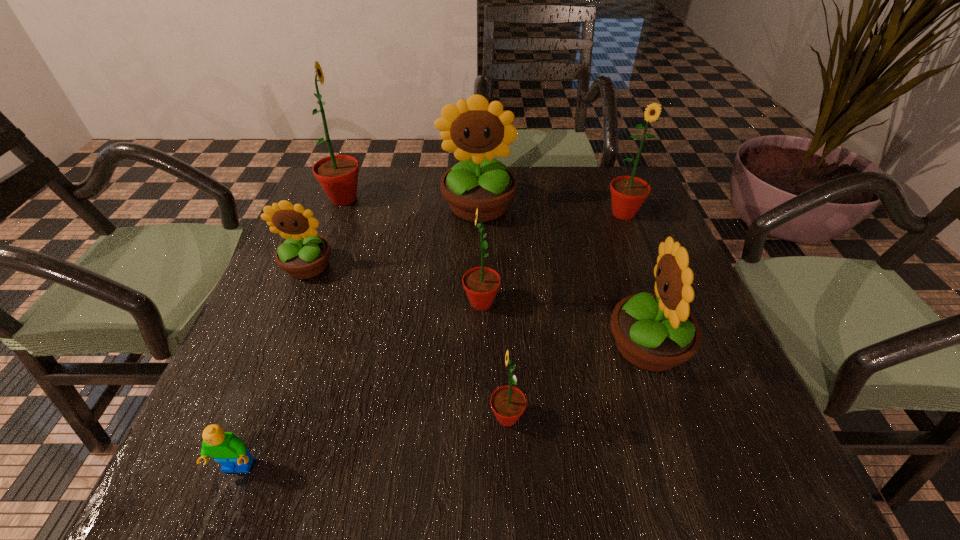
The width and height of the screenshot is (960, 540). Identify the location of object present at the far left corner. (338, 174).

Find the location of a particular element. The height and width of the screenshot is (540, 960). object at the near left corner is located at coordinates (226, 448).

The width and height of the screenshot is (960, 540). Find the location of `object that is at the far right corner`. object that is at the far right corner is located at coordinates (628, 193).

You are a GUI agent. You are given a task and a screenshot of the screen. Output one action in this format:
    pyautogui.click(x=<x>, y=<y>)
    Task: Click on the vacant space at the far edge
    The height and width of the screenshot is (540, 960).
    Given the screenshot: What is the action you would take?
    pyautogui.click(x=530, y=198)

The image size is (960, 540). In order to click on free space at the near edge of the desktop in this screenshot , I will do `click(444, 489)`.

The width and height of the screenshot is (960, 540). What are the coordinates of `free space at the left edge` in the screenshot? It's located at (259, 327).

I want to click on free space at the right edge of the desktop, so click(x=720, y=394).

You are a GUI agent. You are given a task and a screenshot of the screen. Output one action in this format:
    pyautogui.click(x=<x>, y=<y>)
    Task: Click on the vacant space at the near left corner of the desktop
    
    Given the screenshot: What is the action you would take?
    pyautogui.click(x=187, y=464)

This screenshot has height=540, width=960. In order to click on vacant area at the far right corner in this screenshot , I will do `click(601, 177)`.

At what (x,y) coordinates should I click in order to perform the action: click on empty space that is in between the smallest yellow sunflower and the second biggest green sunflower. Please return your answer as a coordinate pair (x, y). Image resolution: width=960 pixels, height=540 pixels. Looking at the image, I should click on (466, 240).